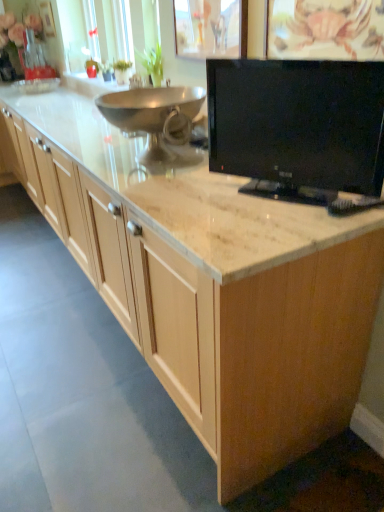
The image size is (384, 512). I want to click on free space underneath polished stainless steel bowl at center (from a real-world perspective), so click(141, 169).